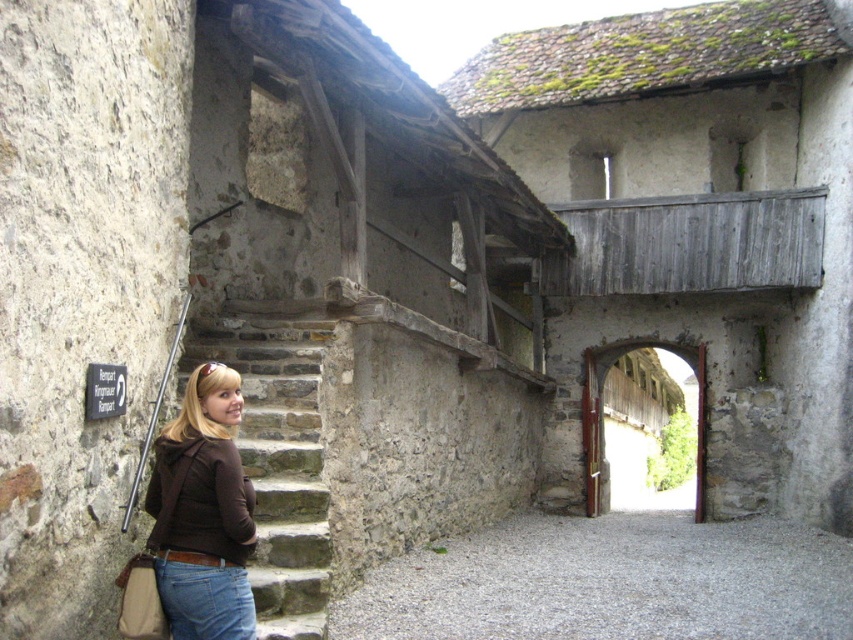
Does stone stairs at left appear under brown matte jacket at lower left?

Incorrect, stone stairs at left is not positioned below brown matte jacket at lower left.

Find the location of a particular element. The image size is (853, 640). stone stairs at left is located at coordinates (277, 456).

Between point (315, 436) and point (229, 413), which one is positioned behind?

Point (315, 436)

At what (x,y) coordinates should I click in order to perform the action: click on stone stairs at left. Please return your answer as a coordinate pair (x, y). This screenshot has width=853, height=640. Looking at the image, I should click on (277, 456).

Which of these two, gray gravel alley at center or brown matte jacket at lower left, stands shorter?

gray gravel alley at center

Is gray gravel alley at center to the left of brown matte jacket at lower left from the viewer's perspective?

No, gray gravel alley at center is not to the left of brown matte jacket at lower left.

Does point (633, 618) come in front of point (252, 509)?

No, (633, 618) is behind (252, 509).

Locate an element on the screen. This screenshot has height=640, width=853. gray gravel alley at center is located at coordinates (610, 582).

Which is above, jeans at lower left or wooden gate at center?

jeans at lower left

What are the coordinates of `jeans at lower left` in the screenshot? It's located at (204, 596).

Which is behind, point (216, 620) or point (596, 362)?

The point (596, 362) is more distant.

Locate an element on the screen. jeans at lower left is located at coordinates (204, 596).